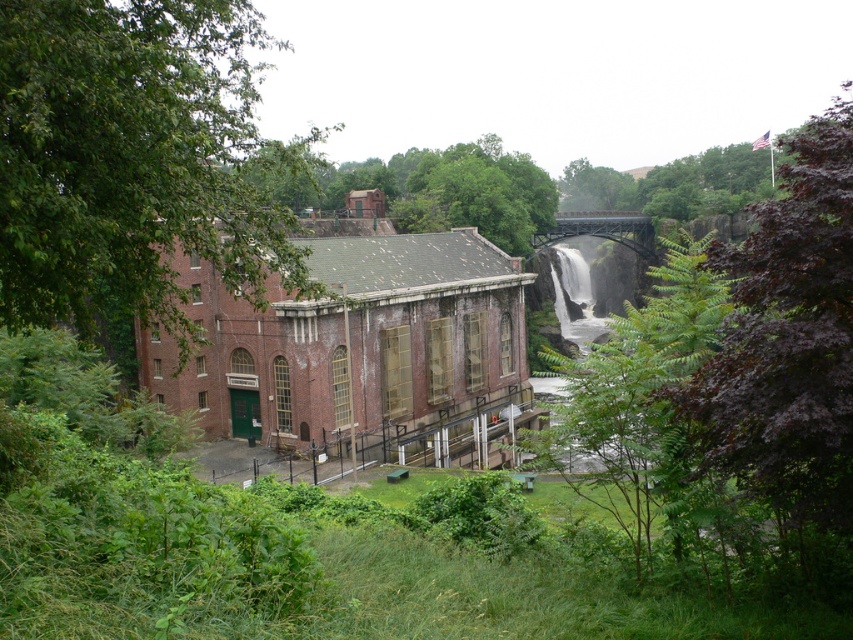
Question: Does green leafy tree at left have a smaller size compared to purple leafy tree at upper right?

Choices:
 (A) yes
 (B) no

Answer: (A)

Question: Considering the relative positions of green leafy tree at left and red brick building at center in the image provided, where is green leafy tree at left located with respect to red brick building at center?

Choices:
 (A) above
 (B) below

Answer: (A)

Question: Considering the real-world distances, which object is farthest from the purple leafy tree at upper right?

Choices:
 (A) red brick building at center
 (B) green leafy tree at left

Answer: (A)

Question: Which point is closer to the camera taking this photo?

Choices:
 (A) (334, 348)
 (B) (805, 180)

Answer: (B)

Question: Can you confirm if green leafy tree at left is positioned above red brick building at center?

Choices:
 (A) yes
 (B) no

Answer: (A)

Question: Considering the real-world distances, which object is closest to the purple leafy tree at upper right?

Choices:
 (A) green leafy tree at left
 (B) red brick building at center

Answer: (A)